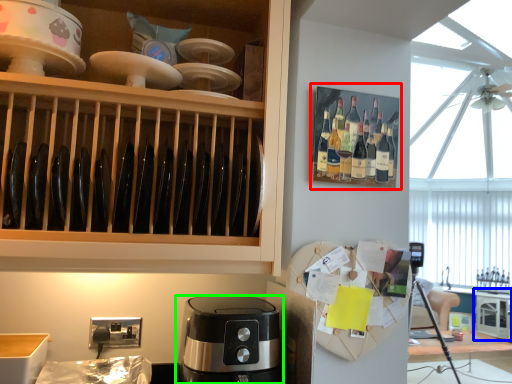
Question: Considering the real-world distances, which object is closest to shelf (highlighted by a red box)? cabinetry (highlighted by a blue box) or coffee maker (highlighted by a green box).

Choices:
 (A) cabinetry
 (B) coffee maker

Answer: (B)